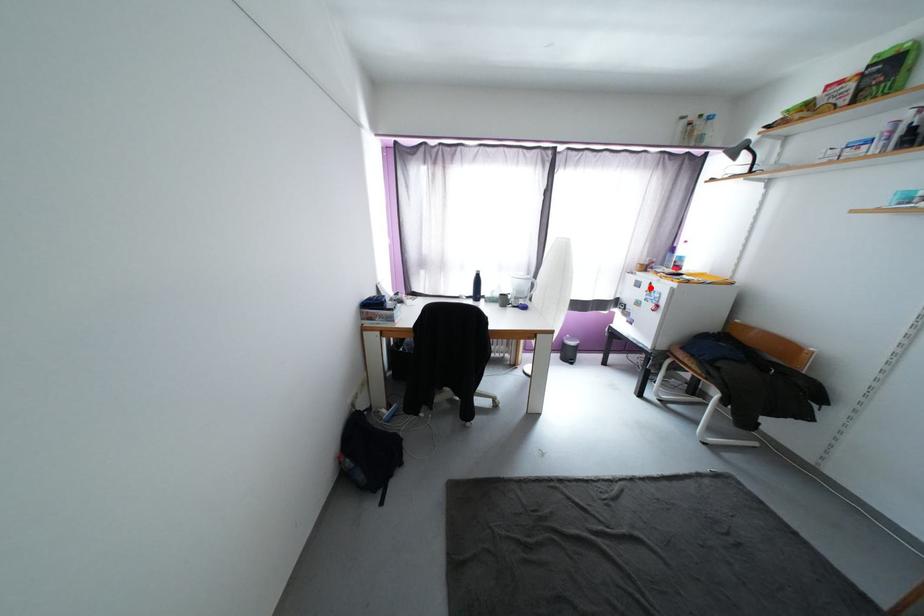
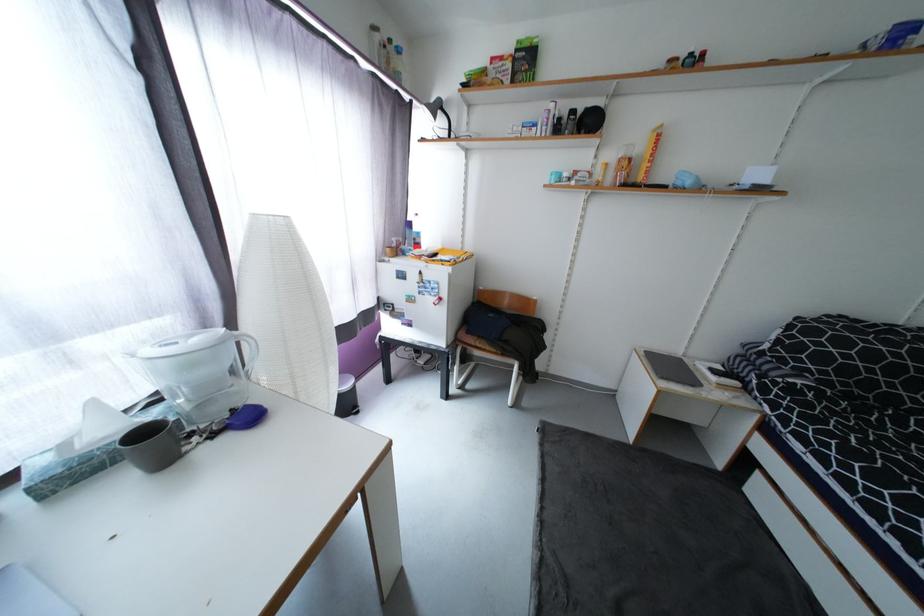
The point at the highlighted location is marked in the first image. Where is the corresponding point in the second image?

(419, 278)